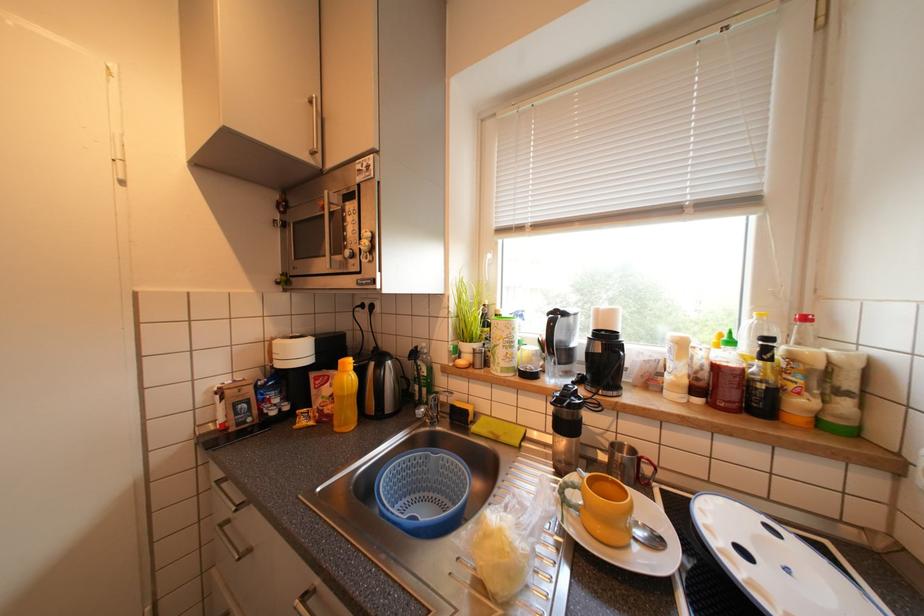
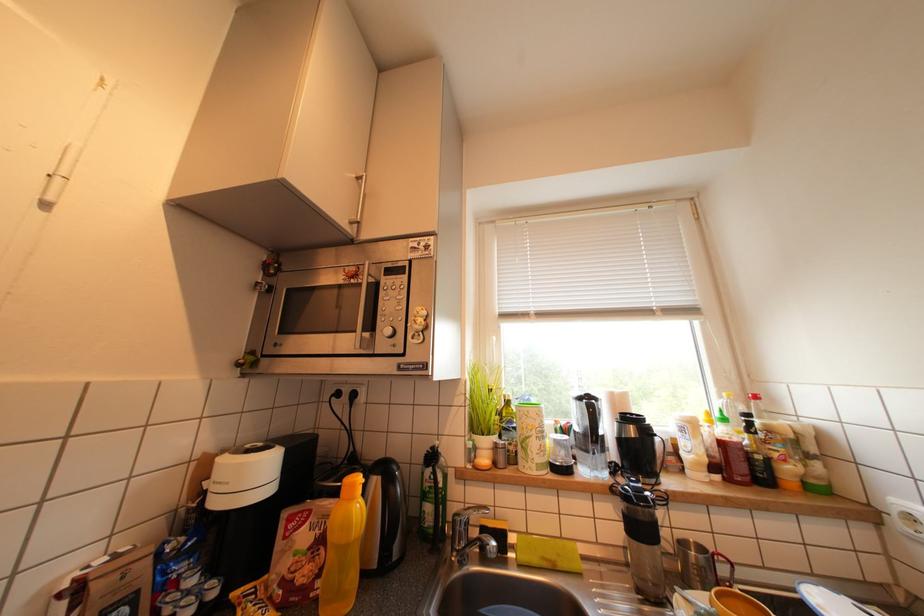
Question: The images are taken continuously from a first-person perspective. In which direction are you moving?

Choices:
 (A) Left
 (B) Right
 (C) Forward
 (D) Backward

Answer: (A)